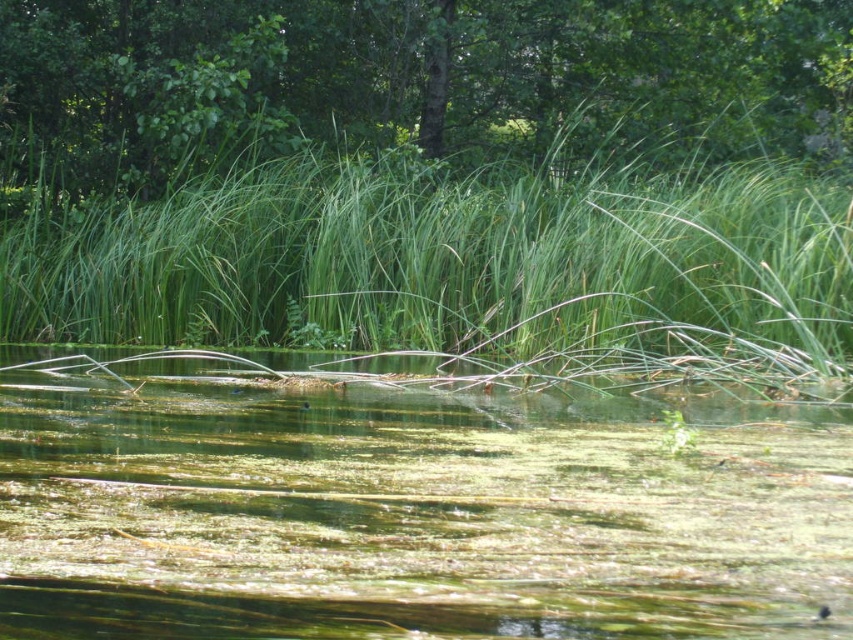
Question: From the image, what is the correct spatial relationship of green grass at center in relation to green leafy tree at upper center?

Choices:
 (A) above
 (B) below

Answer: (B)

Question: Can you confirm if green grass at center is smaller than green leafy tree at upper center?

Choices:
 (A) yes
 (B) no

Answer: (A)

Question: Which of the following is the farthest from the observer?

Choices:
 (A) (490, 29)
 (B) (694, 188)

Answer: (A)

Question: Which of the following is the farthest from the observer?

Choices:
 (A) click(160, 262)
 (B) click(476, 96)

Answer: (B)

Question: Estimate the real-world distances between objects in this image. Which object is farther from the green algae-covered water at center?

Choices:
 (A) green grass at center
 (B) green leafy tree at upper center

Answer: (B)

Question: Does green algae-covered water at center appear under green leafy tree at upper center?

Choices:
 (A) yes
 (B) no

Answer: (A)